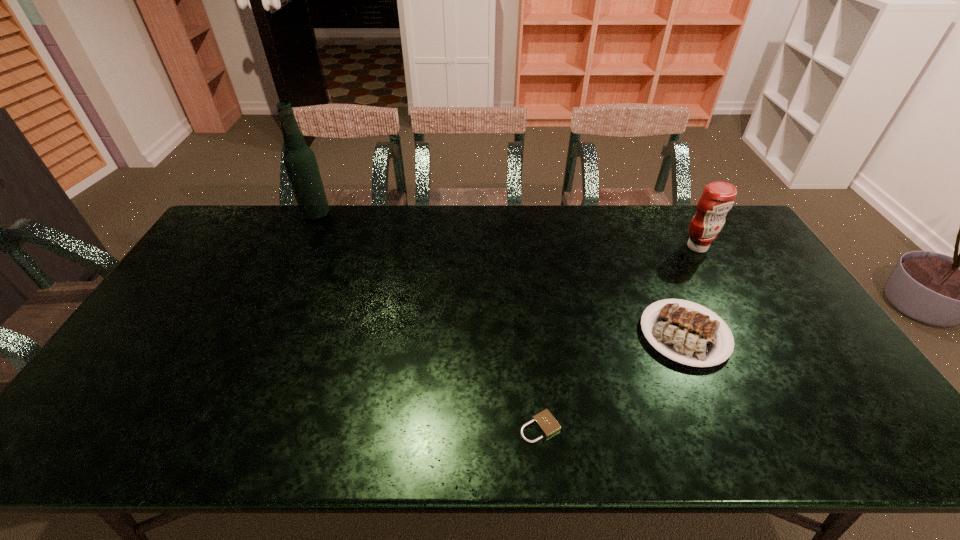
Identify the location of empty location between the third object from right to left and the leftmost object. Image resolution: width=960 pixels, height=540 pixels. (428, 321).

Locate an element on the screen. This screenshot has height=540, width=960. object that stands as the third closest to the nearest object is located at coordinates (300, 162).

Identify which object is the third closest to the second tallest object. Please provide its 2D coordinates. Your answer should be formatted as a tuple, i.e. [(x, y)], where the tuple contains the x and y coordinates of a point satisfying the conditions above.

[(300, 162)]

Locate an element on the screen. vacant space that satisfies the following two spatial constraints: 1. on the front side of the farthest object; 2. on the left side of the padlock is located at coordinates (217, 427).

At what (x,y) coordinates should I click in order to perform the action: click on free space that satisfies the following two spatial constraints: 1. on the back side of the second object from left to right; 2. on the left side of the plate. Please return your answer as a coordinate pair (x, y). The image size is (960, 540). Looking at the image, I should click on (530, 334).

In order to click on vacant space that satisfies the following two spatial constraints: 1. on the back side of the second farthest object; 2. on the right side of the third tallest object in this screenshot , I will do `click(646, 247)`.

Locate an element on the screen. The height and width of the screenshot is (540, 960). free location that satisfies the following two spatial constraints: 1. on the back side of the third nearest object; 2. on the right side of the third farthest object is located at coordinates (646, 247).